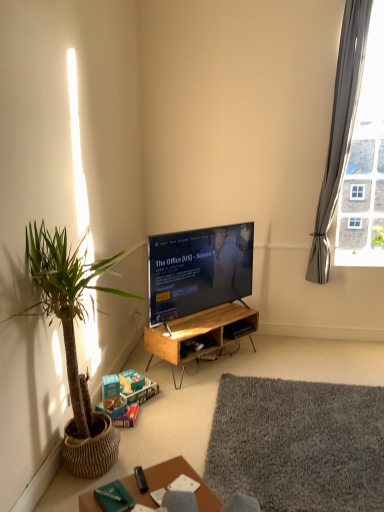
Locate an element on the screen. The height and width of the screenshot is (512, 384). gray shaggy rug at lower center is located at coordinates (298, 444).

Describe the element at coordinates (170, 482) in the screenshot. This screenshot has height=512, width=384. I see `wooden table at lower center` at that location.

Describe the element at coordinates (340, 129) in the screenshot. I see `gray fabric curtain at upper right` at that location.

Measure the distance between black plastic remote control at lower center and camera.

Answer: A distance of 1.77 meters exists between black plastic remote control at lower center and camera.

Measure the distance between point (188, 312) and camera.

The depth of point (188, 312) is 3.53 meters.

Locate an element on the screen. gray shaggy rug at lower center is located at coordinates (298, 444).

From the image's perspective, would you say matte black tv at center is positioned over green woven pot at left?

Yes, from the image's perspective, matte black tv at center is above green woven pot at left.

Between matte black tv at center and green woven pot at left, which one appears on the left side from the viewer's perspective?

Positioned to the left is green woven pot at left.

How different are the orientations of matte black tv at center and green woven pot at left in degrees?

39.6 degrees separate the facing orientations of matte black tv at center and green woven pot at left.

Consider the image. Between matte black tv at center and green woven pot at left, which one is positioned in front?

green woven pot at left.

From a real-world perspective, is gray shaggy rug at lower center over green woven pot at left?

No, from a real-world perspective, gray shaggy rug at lower center is not on top of green woven pot at left.

Which is in front, point (228, 414) or point (115, 256)?

The point (115, 256) is in front.

Which object is positioned more to the left, gray shaggy rug at lower center or green woven pot at left?

From the viewer's perspective, green woven pot at left appears more on the left side.

Is green woven pot at left surrounded by gray shaggy rug at lower center?

Actually, green woven pot at left is outside gray shaggy rug at lower center.

Can you tell me how much wooden table at lower center and gray shaggy rug at lower center differ in facing direction?

130 degrees separate the facing orientations of wooden table at lower center and gray shaggy rug at lower center.

Who is smaller, wooden table at lower center or gray shaggy rug at lower center?

wooden table at lower center.

From the image's perspective, which object appears higher, wooden table at lower center or gray shaggy rug at lower center?

Answer: gray shaggy rug at lower center, from the image's perspective.

Looking at the image, does woodenmaterial/texturedesk at center seem bigger or smaller compared to matte black tv at center?

In the image, woodenmaterial/texturedesk at center appears to be smaller than matte black tv at center.

Is the position of woodenmaterial/texturedesk at center less distant than that of matte black tv at center?

No.

From the image's perspective, would you say woodenmaterial/texturedesk at center is shown under matte black tv at center?

Indeed, from the image's perspective, woodenmaterial/texturedesk at center is shown beneath matte black tv at center.

Between woodenmaterial/texturedesk at center and matte black tv at center, which one has smaller width?

Thinner between the two is matte black tv at center.

Looking at this image, from the image's perspective, which is below, black plastic remote control at lower center or woodenmaterial/texturedesk at center?

black plastic remote control at lower center appears lower in the image.

Which is correct: black plastic remote control at lower center is inside woodenmaterial/texturedesk at center, or outside of it?

black plastic remote control at lower center is spatially situated outside woodenmaterial/texturedesk at center.

Does black plastic remote control at lower center turn towards woodenmaterial/texturedesk at center?

No, black plastic remote control at lower center does not turn towards woodenmaterial/texturedesk at center.

Does black plastic remote control at lower center appear on the left side of woodenmaterial/texturedesk at center?

Indeed, black plastic remote control at lower center is positioned on the left side of woodenmaterial/texturedesk at center.

Locate an element on the screen. desk that is on the right side of green woven pot at left is located at coordinates (201, 335).

Which of these two, green woven pot at left or woodenmaterial/texturedesk at center, is thinner?

Thinner between the two is woodenmaterial/texturedesk at center.

Is green woven pot at left smaller than woodenmaterial/texturedesk at center?

Incorrect, green woven pot at left is not smaller in size than woodenmaterial/texturedesk at center.

Is point (57, 287) closer to viewer compared to point (176, 347)?

Yes, it is in front of point (176, 347).

Which of these two, gray shaggy rug at lower center or gray fabric curtain at upper right, stands taller?

gray fabric curtain at upper right.

Is gray shaggy rug at lower center smaller than gray fabric curtain at upper right?

Correct, gray shaggy rug at lower center occupies less space than gray fabric curtain at upper right.

Consider the image. From a real-world perspective, who is located higher, gray shaggy rug at lower center or gray fabric curtain at upper right?

In real-world perspective, gray fabric curtain at upper right is above.

Image resolution: width=384 pixels, height=512 pixels. Identify the location of television above the green woven pot at left (from the image's perspective). [x=198, y=270].

Find the location of a particular element. The height and width of the screenshot is (512, 384). houseplant above the gray shaggy rug at lower center (from a real-world perspective) is located at coordinates (67, 306).

Looking at this image, based on their spatial positions, is matte black tv at center or green woven pot at left closer to gray shaggy rug at lower center?

green woven pot at left is closer to gray shaggy rug at lower center.

Which object lies further to the anchor point matte black tv at center, woodenmaterial/texturedesk at center or wooden table at lower center?

Among the two, wooden table at lower center is located further to matte black tv at center.

Based on their spatial positions, is woodenmaterial/texturedesk at center or black plastic remote control at lower center closer to gray fabric curtain at upper right?

Based on the image, woodenmaterial/texturedesk at center appears to be nearer to gray fabric curtain at upper right.

When comparing their distances from matte black tv at center, does gray shaggy rug at lower center or black plastic remote control at lower center seem closer?

The object closer to matte black tv at center is gray shaggy rug at lower center.

Looking at the image, which one is located further to gray fabric curtain at upper right, wooden table at lower center or green woven pot at left?

Among the two, wooden table at lower center is located further to gray fabric curtain at upper right.

Estimate the real-world distances between objects in this image. Which object is further from gray shaggy rug at lower center, black plastic remote control at lower center or green woven pot at left?

The object further to gray shaggy rug at lower center is green woven pot at left.

In the scene shown: Looking at the image, which one is located closer to gray fabric curtain at upper right, green woven pot at left or wooden table at lower center?

Among the two, green woven pot at left is located nearer to gray fabric curtain at upper right.

Considering their positions, is wooden table at lower center positioned further to gray shaggy rug at lower center than gray fabric curtain at upper right?

gray fabric curtain at upper right is positioned further to the anchor gray shaggy rug at lower center.

Identify the location of desk between gray fabric curtain at upper right and gray shaggy rug at lower center vertically. (201, 335).

The height and width of the screenshot is (512, 384). Find the location of `mat between wooden table at lower center and matte black tv at center along the z-axis`. mat between wooden table at lower center and matte black tv at center along the z-axis is located at coordinates (298, 444).

This screenshot has height=512, width=384. I want to click on houseplant between gray fabric curtain at upper right and gray shaggy rug at lower center from top to bottom, so click(x=67, y=306).

I want to click on remote control located between green woven pot at left and matte black tv at center in the depth direction, so click(140, 479).